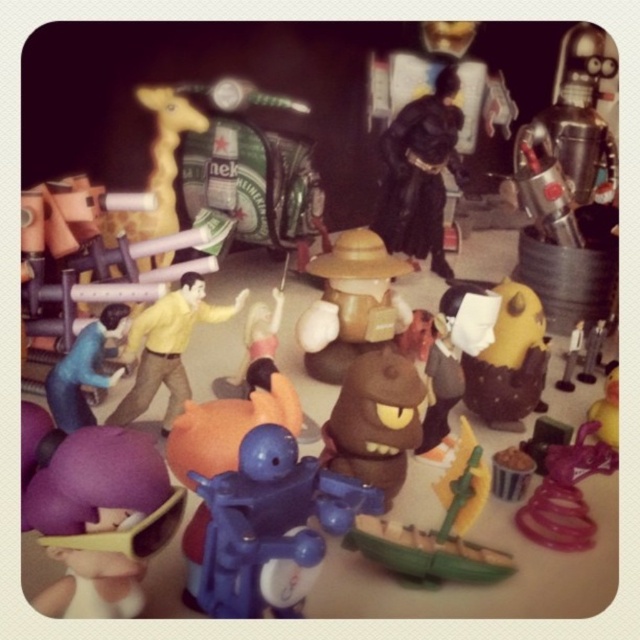
Question: Estimate the real-world distances between objects in this image. Which object is closer to the blue matte figure at lower left?

Choices:
 (A) brown matte plush toy at center
 (B) black matte figure at center
 (C) green plastic boat at center
 (D) matte yellow toy at center

Answer: (A)

Question: Can you confirm if matte yellow toy at center is positioned above matte yellow figure at center?

Choices:
 (A) yes
 (B) no

Answer: (A)

Question: Estimate the real-world distances between objects in this image. Which object is farther from the blue plastic robot at center?

Choices:
 (A) brown matte plush toy at center
 (B) brown matte figure at center

Answer: (B)

Question: Does blue plastic robot at center have a larger size compared to spiral pink plastic at lower right?

Choices:
 (A) no
 (B) yes

Answer: (B)

Question: Estimate the real-world distances between objects in this image. Which object is closer to the black matte figure at center?

Choices:
 (A) purple matte plush toy at lower left
 (B) green plastic boat at center

Answer: (B)

Question: Does brown matte plush toy at center appear on the right side of green plastic boat at center?

Choices:
 (A) yes
 (B) no

Answer: (B)